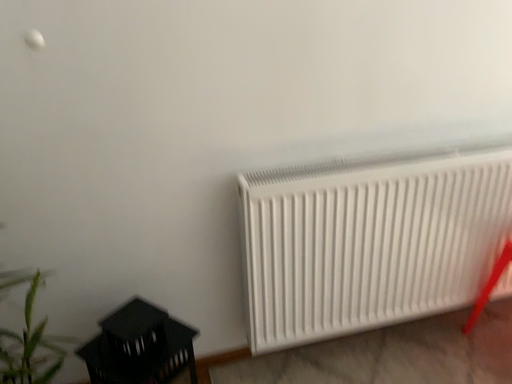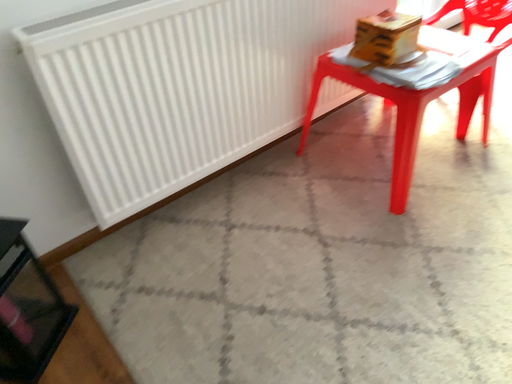
Question: Which way did the camera rotate in the video?

Choices:
 (A) rotated left
 (B) rotated right

Answer: (B)